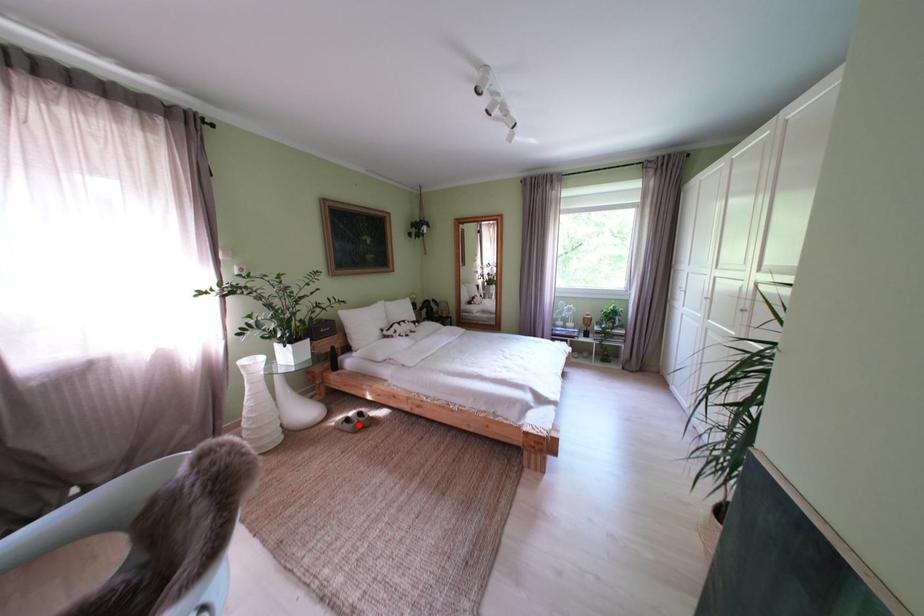
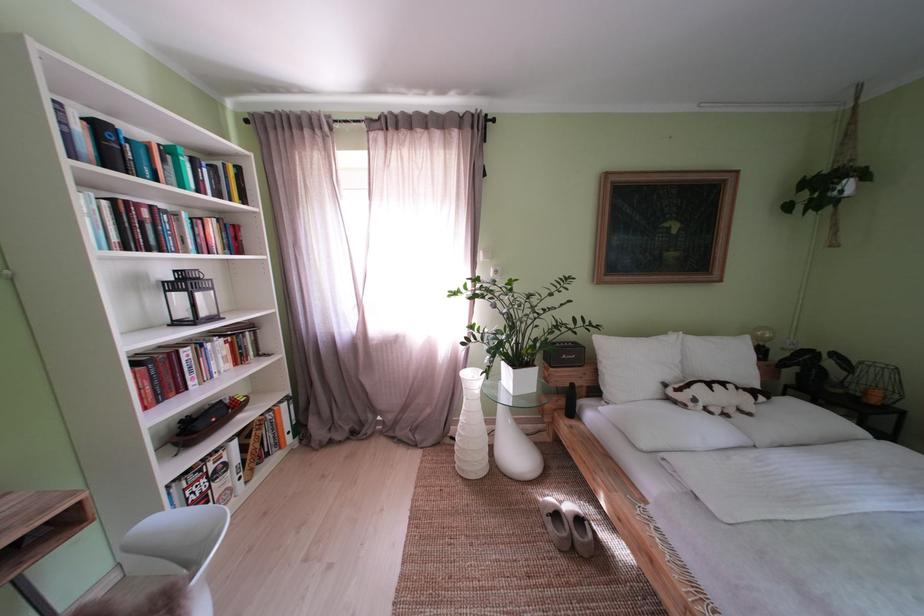
Question: I am providing you with two images of the same scene from different viewpoints. In image1, a red point is highlighted. Considering the same 3D point in image2, which of the following is correct?

Choices:
 (A) It is closer
 (B) It is farther

Answer: (A)